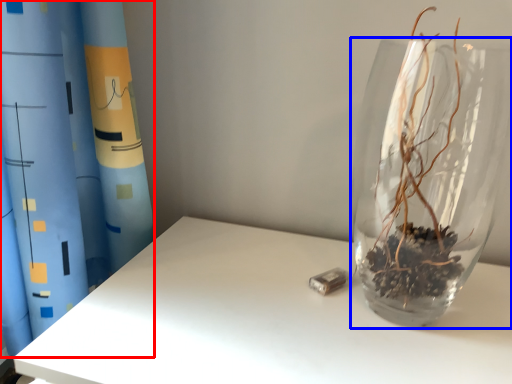
Question: Which of the following is the closest to the observer, curtain (highlighted by a red box) or vase (highlighted by a blue box)?

Choices:
 (A) curtain
 (B) vase

Answer: (A)